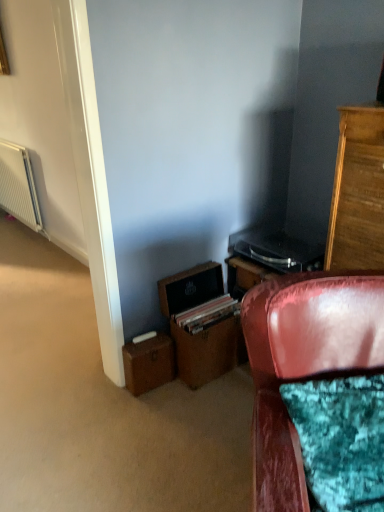
I want to click on vacant space to the left of brown cardboard box at lower left, so click(105, 396).